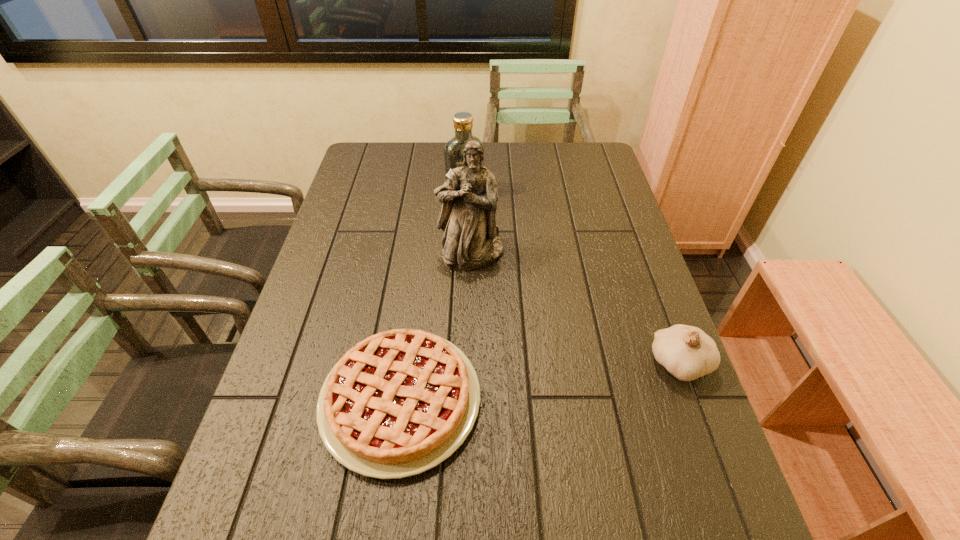
Where is `vacant area situated on the front-facing side of the vodka`? The image size is (960, 540). vacant area situated on the front-facing side of the vodka is located at coordinates (495, 239).

This screenshot has height=540, width=960. What are the coordinates of `free space located 0.050m on the front-facing side of the vodka` in the screenshot? It's located at (477, 210).

I want to click on free space located on the front-facing side of the figurine, so coord(497,308).

Find the location of a particular element. vacant region located 0.330m on the front-facing side of the figurine is located at coordinates (523, 368).

This screenshot has width=960, height=540. Find the location of `free space located 0.070m on the front-facing side of the figurine`. free space located 0.070m on the front-facing side of the figurine is located at coordinates (489, 288).

Image resolution: width=960 pixels, height=540 pixels. I want to click on object situated at the near edge, so click(400, 402).

At what (x,y) coordinates should I click in order to perform the action: click on object at the left edge. Please return your answer as a coordinate pair (x, y). Image resolution: width=960 pixels, height=540 pixels. Looking at the image, I should click on (400, 402).

Locate an element on the screen. object that is at the right edge is located at coordinates (687, 352).

Locate an element on the screen. The width and height of the screenshot is (960, 540). object present at the near left corner is located at coordinates (400, 402).

Where is `vacant space at the far edge`? This screenshot has height=540, width=960. vacant space at the far edge is located at coordinates (434, 144).